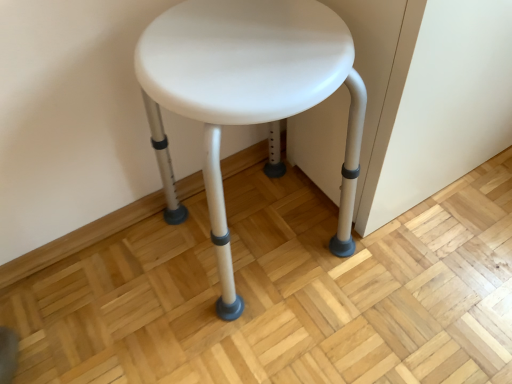
What are the coordinates of `vacant space underneath white plastic stool at center (from a real-world perspective)` in the screenshot? It's located at (259, 239).